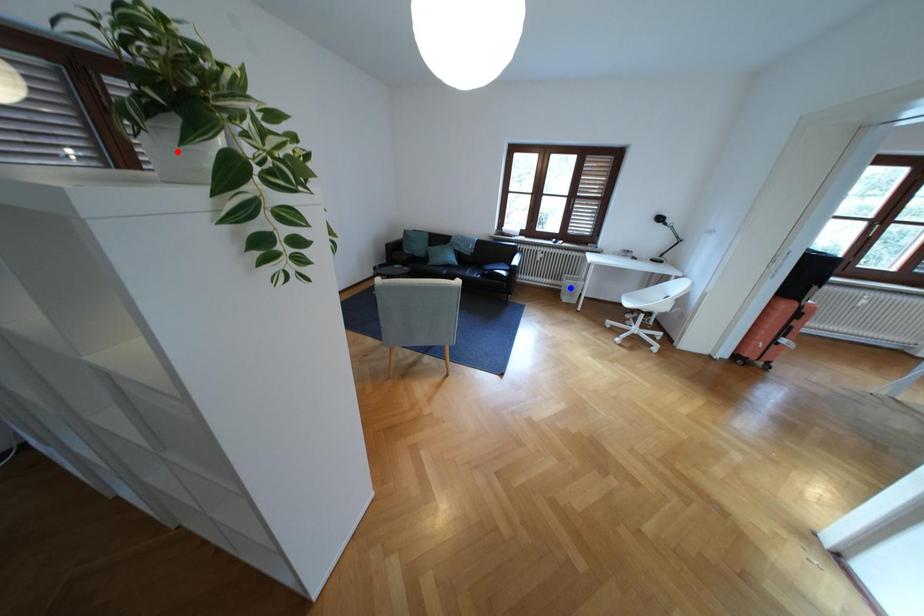
Question: In the image, two points are highlighted. Which point is nearer to the camera? Reply with the corresponding letter.

Choices:
 (A) blue point
 (B) red point

Answer: (B)